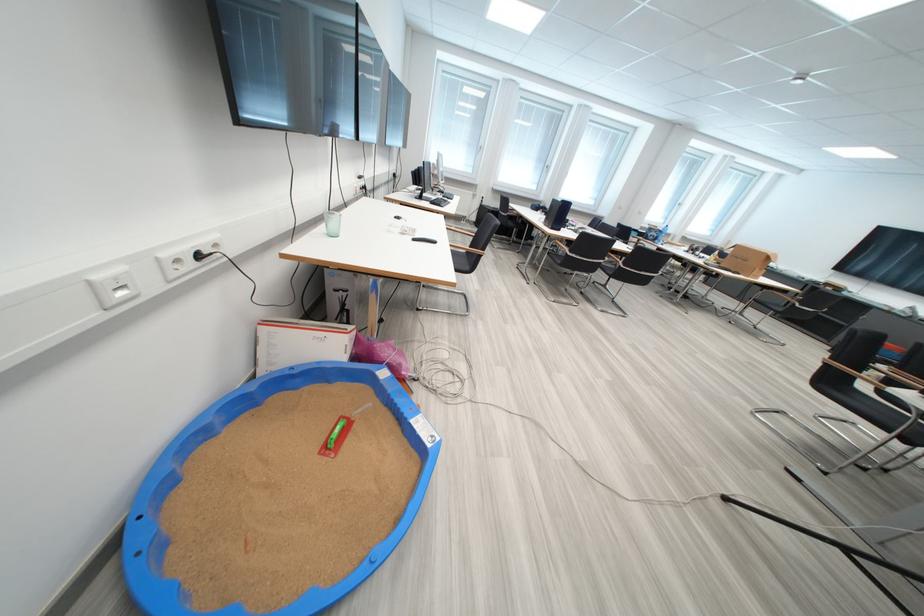
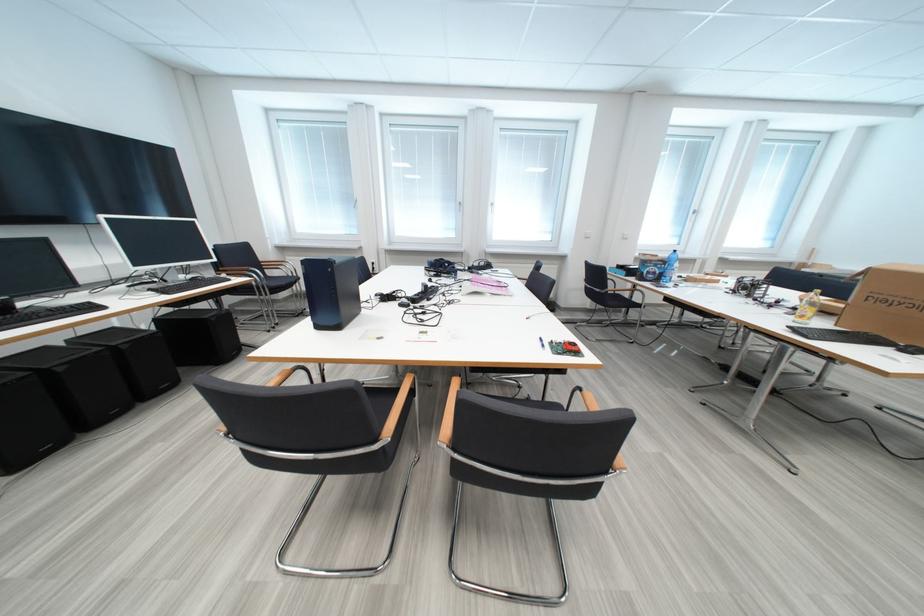
In a continuous first-person perspective shot, in which direction is the camera moving?

The cameraman moved toward right, forward.